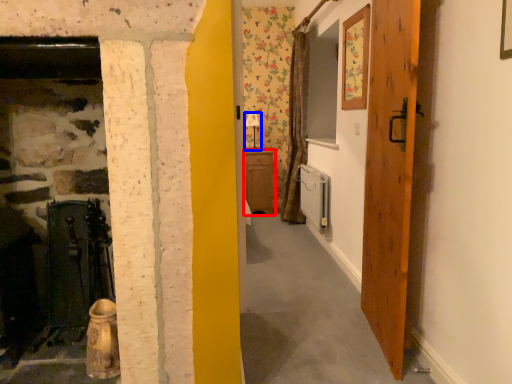
Question: Which object appears closest to the camera in this image, cabinetry (highlighted by a red box) or lamp (highlighted by a blue box)?

Choices:
 (A) cabinetry
 (B) lamp

Answer: (A)